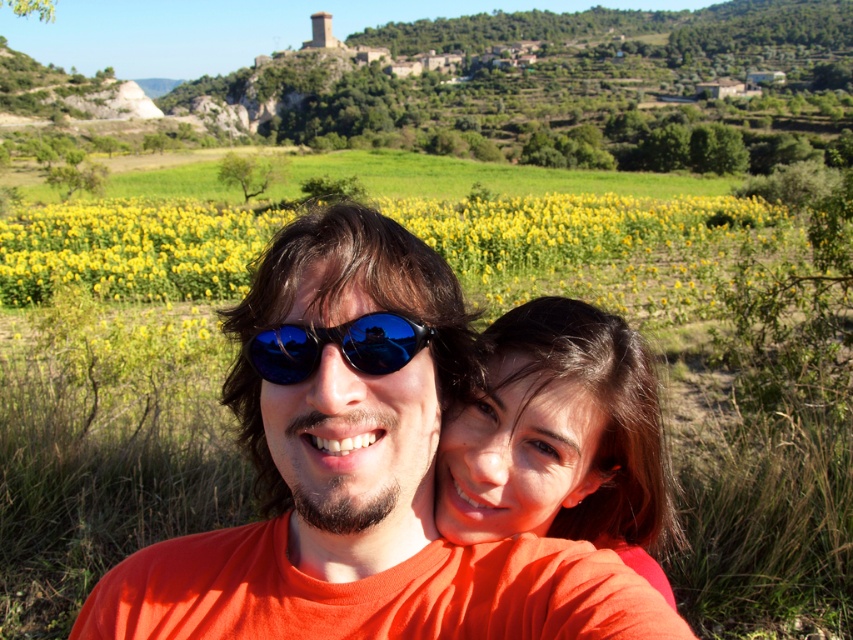
Question: Is smooth brown hair at center thinner than yellow matte sunflower at center?

Choices:
 (A) no
 (B) yes

Answer: (B)

Question: Is matte orange t-shirt at center further to the viewer compared to smooth brown hair at center?

Choices:
 (A) no
 (B) yes

Answer: (A)

Question: Is smooth brown hair at center smaller than blue reflective sunglasses at center?

Choices:
 (A) no
 (B) yes

Answer: (A)

Question: Which object is the farthest from the smooth brown hair at center?

Choices:
 (A) matte orange t-shirt at center
 (B) blue reflective sunglasses at center
 (C) yellow matte sunflower at center

Answer: (C)

Question: Among these objects, which one is nearest to the camera?

Choices:
 (A) blue reflective sunglasses at center
 (B) matte orange t-shirt at center
 (C) yellow matte sunflower at center

Answer: (B)

Question: Which object appears closest to the camera in this image?

Choices:
 (A) smooth brown hair at center
 (B) blue reflective sunglasses at center

Answer: (B)